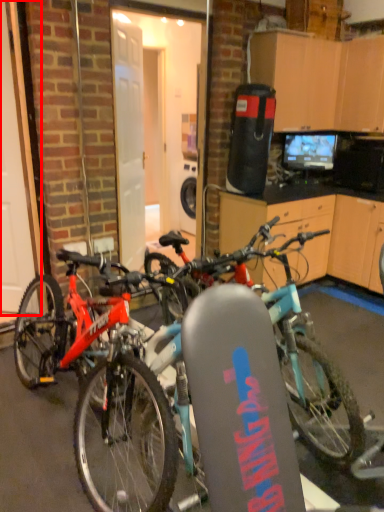
Question: From the image's perspective, what is the correct spatial positioning of garage door (annotated by the red box) in reference to bicycle?

Choices:
 (A) above
 (B) below

Answer: (A)